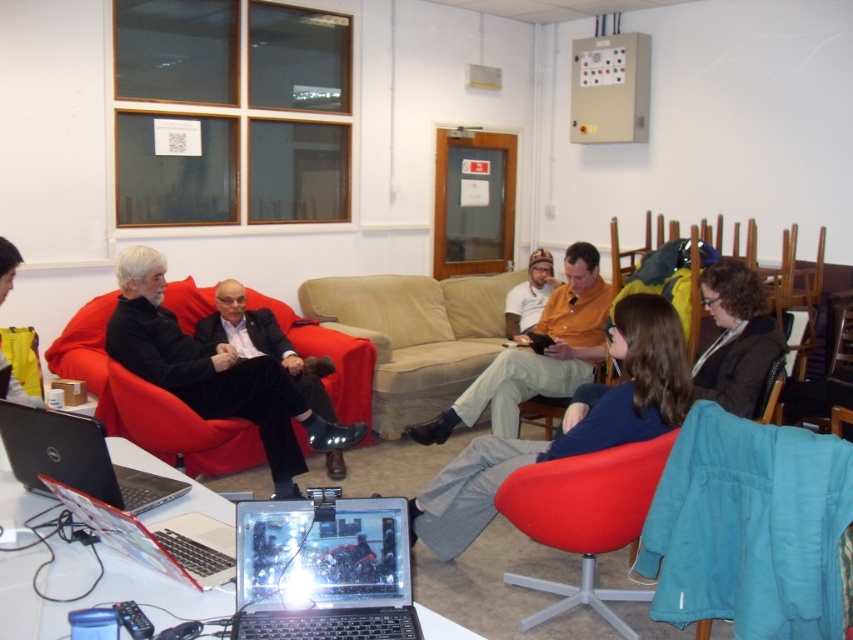
Question: Which point appears farthest from the camera in this image?

Choices:
 (A) pyautogui.click(x=508, y=358)
 (B) pyautogui.click(x=624, y=419)

Answer: (A)

Question: Is brown woolen sweater at lower right to the right of silver metallic laptop at lower center from the viewer's perspective?

Choices:
 (A) yes
 (B) no

Answer: (A)

Question: Does matte red armchair at lower center appear under yellow fabric at lower left?

Choices:
 (A) yes
 (B) no

Answer: (A)

Question: Which of the following is the closest to the observer?

Choices:
 (A) (714, 365)
 (B) (682, 376)
 (C) (485, 339)

Answer: (B)

Question: Which of the following is the closest to the observer?

Choices:
 (A) wooden chair at center
 (B) silver metallic laptop at lower left
 (C) blue cotton shirt at center
 (D) black leather jacket at center

Answer: (B)

Question: Is brown woolen sweater at lower right smaller than wooden chair at center?

Choices:
 (A) no
 (B) yes

Answer: (B)